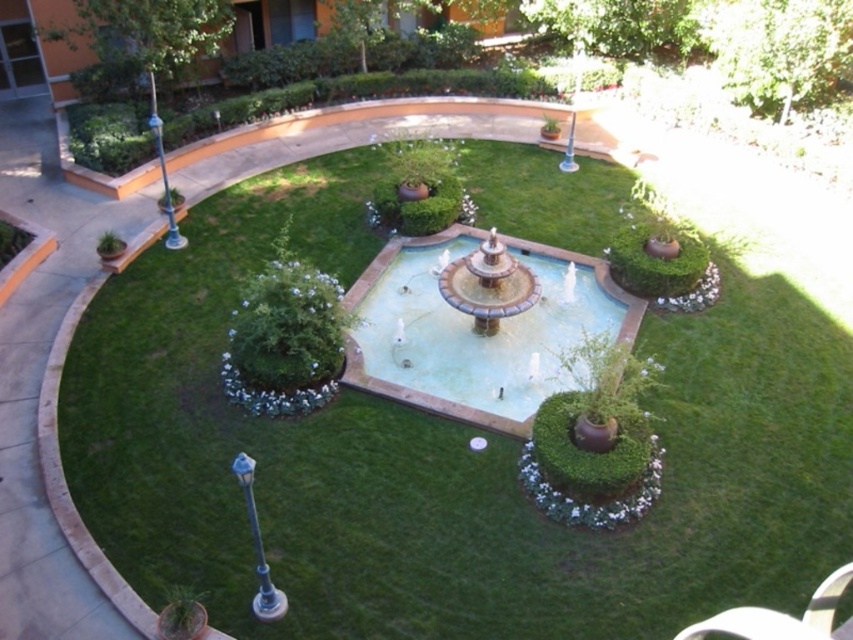
Consider the image. You are standing at point (x=444, y=456) in the garden. What is the immediate object beneath your feet?

The immediate object beneath your feet at point (x=444, y=456) is green grass at center.

Based on the photo, you are a landscape architect planning to install a new lighting system around the garden. You need to place lights on the green grass at center and the smooth stone fountain at center. Based on their positions, which object is located above the other?

The smooth stone fountain at center is positioned above the green grass at center, so the fountain is above the grass.